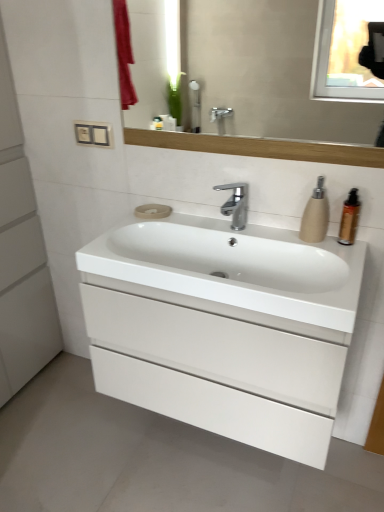
Describe the element at coordinates (152, 211) in the screenshot. The image size is (384, 512). I see `beige matte soap at center` at that location.

In order to face brown glossy bottle at right, should I rotate leftwards or rightwards?

It's best to rotate right around 20.458 degrees.

This screenshot has width=384, height=512. What do you see at coordinates (235, 204) in the screenshot? I see `polished chrome faucet at center` at bounding box center [235, 204].

The height and width of the screenshot is (512, 384). Describe the element at coordinates (21, 256) in the screenshot. I see `white matte cabinet at left` at that location.

The image size is (384, 512). Describe the element at coordinates (224, 328) in the screenshot. I see `white glossy cabinet at center` at that location.

What do you see at coordinates (233, 273) in the screenshot? I see `white glossy sink at center` at bounding box center [233, 273].

Locate an element on the screen. The width and height of the screenshot is (384, 512). matte wooden mirror at upper center is located at coordinates coord(264,72).

Is polished chrome faucet at center in front of or behind white glossy cabinet at center in the image?

Visually, polished chrome faucet at center is located behind white glossy cabinet at center.

Does point (230, 210) come in front of point (218, 361)?

That is False.

Find the location of a particular element. bathroom cabinet on the left of polished chrome faucet at center is located at coordinates (224, 328).

From their relative heights in the image, would you say matte beige soap dispenser at right is taller or shorter than polished chrome faucet at center?

matte beige soap dispenser at right is taller than polished chrome faucet at center.

Based on the photo, considering the relative sizes of matte beige soap dispenser at right and polished chrome faucet at center in the image provided, is matte beige soap dispenser at right smaller than polished chrome faucet at center?

Yes, matte beige soap dispenser at right is smaller than polished chrome faucet at center.

Is matte beige soap dispenser at right not close to polished chrome faucet at center?

matte beige soap dispenser at right is actually quite close to polished chrome faucet at center.

Is matte beige soap dispenser at right looking in the opposite direction of polished chrome faucet at center?

No, matte beige soap dispenser at right is not facing away from polished chrome faucet at center.

How different are the orientations of white glossy cabinet at center and white matte cabinet at left in degrees?

They differ by 90.5 degrees in their facing directions.

Is white glossy cabinet at center smaller than white matte cabinet at left?

Yes.

Is white glossy cabinet at center further to the viewer compared to white matte cabinet at left?

No, it is not.

Is there a large distance between white glossy cabinet at center and white matte cabinet at left?

Actually, white glossy cabinet at center and white matte cabinet at left are a little close together.

Measure the distance between polished chrome faucet at center and brown glossy bottle at right.

polished chrome faucet at center and brown glossy bottle at right are 13.39 inches apart.

From a real-world perspective, who is located higher, polished chrome faucet at center or brown glossy bottle at right?

brown glossy bottle at right.

Identify the location of tap located above the brown glossy bottle at right (from the image's perspective). The image size is (384, 512). (235, 204).

Would you say polished chrome faucet at center is a long distance from brown glossy bottle at right?

polished chrome faucet at center is actually quite close to brown glossy bottle at right.

From a real-world perspective, which object rests below the other?

white matte cabinet at left.

Can you confirm if white matte cabinet at left is positioned to the right of polished chrome faucet at center?

Incorrect, white matte cabinet at left is not on the right side of polished chrome faucet at center.

Is white matte cabinet at left thinner than polished chrome faucet at center?

No, white matte cabinet at left is not thinner than polished chrome faucet at center.

Based on the photo, is white matte cabinet at left positioned with its back to polished chrome faucet at center?

white matte cabinet at left is not turned away from polished chrome faucet at center.

In terms of size, does polished chrome faucet at center appear bigger or smaller than beige matte soap at center?

In the image, polished chrome faucet at center appears to be larger than beige matte soap at center.

Considering the positions of point (246, 190) and point (163, 212), is point (246, 190) closer or farther from the camera than point (163, 212)?

Point (246, 190) appears to be closer to the viewer than point (163, 212).

Considering the positions of objects brown glossy bottle at right and matte wooden mirror at upper center in the image provided, who is in front, brown glossy bottle at right or matte wooden mirror at upper center?

matte wooden mirror at upper center is closer to the camera.

Can you confirm if brown glossy bottle at right is bigger than matte wooden mirror at upper center?

No, brown glossy bottle at right is not bigger than matte wooden mirror at upper center.

Measure the distance between brown glossy bottle at right and matte wooden mirror at upper center.

brown glossy bottle at right is 9.00 feet away from matte wooden mirror at upper center.

Considering the points (352, 192) and (213, 20), which point is in front, point (352, 192) or point (213, 20)?

The point (352, 192) is closer.

The height and width of the screenshot is (512, 384). Find the location of `bathroom cabinet directly beneath the polished chrome faucet at center (from a real-world perspective)`. bathroom cabinet directly beneath the polished chrome faucet at center (from a real-world perspective) is located at coordinates (224, 328).

The height and width of the screenshot is (512, 384). What are the coordinates of `soap dispenser above the polished chrome faucet at center (from a real-world perspective)` in the screenshot? It's located at (315, 215).

Estimate the real-world distances between objects in this image. Which object is closer to brown glossy bottle at right, white glossy sink at center or white glossy cabinet at center?

white glossy sink at center.

From the image, which object appears to be nearer to white glossy sink at center, white matte cabinet at left or matte wooden mirror at upper center?

white matte cabinet at left is closer to white glossy sink at center.

Which object lies further to the anchor point brown glossy bottle at right, beige matte soap at center or matte wooden mirror at upper center?

The object further to brown glossy bottle at right is matte wooden mirror at upper center.

Estimate the real-world distances between objects in this image. Which object is further from white glossy cabinet at center, white matte cabinet at left or brown glossy bottle at right?

white matte cabinet at left lies further to white glossy cabinet at center than the other object.

Which object lies nearer to the anchor point beige matte soap at center, white glossy sink at center or matte wooden mirror at upper center?

The object closer to beige matte soap at center is white glossy sink at center.

Considering their positions, is matte beige soap dispenser at right positioned closer to brown glossy bottle at right than white matte cabinet at left?

The object closer to brown glossy bottle at right is matte beige soap dispenser at right.

Looking at the image, which one is located closer to matte wooden mirror at upper center, brown glossy bottle at right or white glossy cabinet at center?

The object closer to matte wooden mirror at upper center is white glossy cabinet at center.

From the image, which object appears to be nearer to white matte cabinet at left, white glossy cabinet at center or brown glossy bottle at right?

white glossy cabinet at center.

Locate an element on the screen. The height and width of the screenshot is (512, 384). toiletry between polished chrome faucet at center and white glossy cabinet at center in the vertical direction is located at coordinates (349, 218).

At what (x,y) coordinates should I click in order to perform the action: click on bathroom cabinet between white matte cabinet at left and matte beige soap dispenser at right in the horizontal direction. Please return your answer as a coordinate pair (x, y). The image size is (384, 512). Looking at the image, I should click on point(224,328).

This screenshot has width=384, height=512. Find the location of `counter top that lies between matte wooden mirror at upper center and white glossy cabinet at center from top to bottom`. counter top that lies between matte wooden mirror at upper center and white glossy cabinet at center from top to bottom is located at coordinates (233, 273).

Locate an element on the screen. soap located between white matte cabinet at left and white glossy cabinet at center in the left-right direction is located at coordinates tap(152, 211).